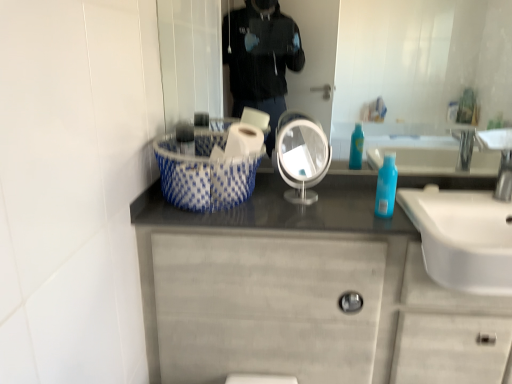
Question: In terms of width, does white glossy sink at right look wider or thinner when compared to matte gray cabinet at center?

Choices:
 (A) thin
 (B) wide

Answer: (B)

Question: Based on their sizes in the image, would you say white glossy sink at right is bigger or smaller than matte gray cabinet at center?

Choices:
 (A) small
 (B) big

Answer: (A)

Question: Which of these objects is positioned closest to the matte gray cabinet at center?

Choices:
 (A) blue dotted fabric basket at center
 (B) white glossy toilet paper at center
 (C) blue glossy bottle at right
 (D) matte silver mirror at center, which is the second mirror in left-to-right order
 (E) white glossy mirror at center, the 2th mirror viewed from the right

Answer: (A)

Question: Estimate the real-world distances between objects in this image. Which object is closer to the white glossy sink at right?

Choices:
 (A) blue dotted fabric basket at center
 (B) blue glossy bottle at right
 (C) matte silver mirror at center, marked as the first mirror in a right-to-left arrangement
 (D) white glossy toilet paper at center
 (E) matte gray cabinet at center

Answer: (B)